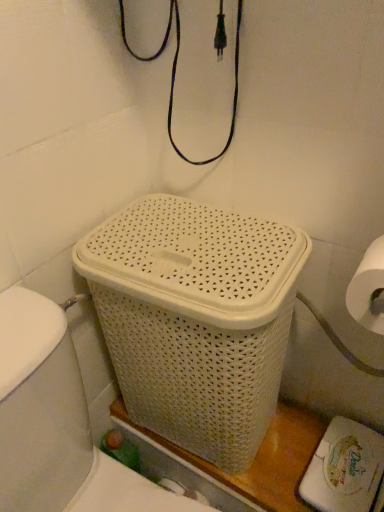
Question: Is white woven basket at center bigger or smaller than white woven laundry basket at center?

Choices:
 (A) big
 (B) small

Answer: (B)

Question: Considering the positions of white woven basket at center and white woven laundry basket at center in the image, is white woven basket at center wider or thinner than white woven laundry basket at center?

Choices:
 (A) thin
 (B) wide

Answer: (A)

Question: Considering the relative positions of white woven basket at center and white woven laundry basket at center in the image provided, is white woven basket at center to the left or to the right of white woven laundry basket at center?

Choices:
 (A) right
 (B) left

Answer: (A)

Question: In terms of height, does white woven laundry basket at center look taller or shorter compared to white woven basket at center?

Choices:
 (A) short
 (B) tall

Answer: (B)

Question: Relative to white woven basket at center, is white woven laundry basket at center in front or behind?

Choices:
 (A) behind
 (B) front

Answer: (B)

Question: Would you say white woven laundry basket at center is inside or outside white woven basket at center?

Choices:
 (A) outside
 (B) inside

Answer: (A)

Question: Looking at their shapes, would you say white woven laundry basket at center is wider or thinner than white woven basket at center?

Choices:
 (A) thin
 (B) wide

Answer: (B)